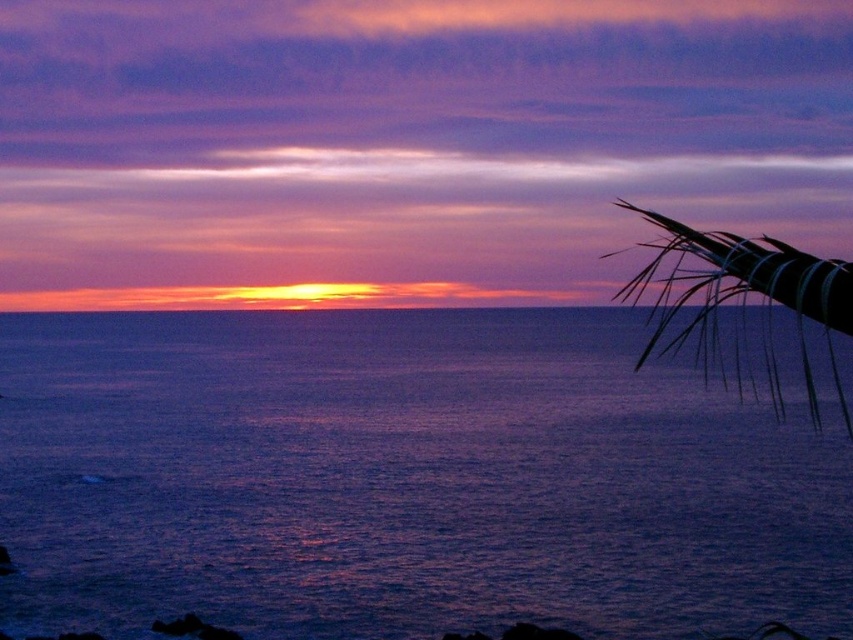
Question: Is purple water at center positioned at the back of silvery metallic palm fronds at upper right?

Choices:
 (A) yes
 (B) no

Answer: (A)

Question: Does purple water at center appear on the left side of silvery metallic palm fronds at upper right?

Choices:
 (A) yes
 (B) no

Answer: (A)

Question: Which object appears closest to the camera in this image?

Choices:
 (A) purple water at center
 (B) silvery metallic palm fronds at upper right

Answer: (B)

Question: Is purple water at center to the right of silvery metallic palm fronds at upper right from the viewer's perspective?

Choices:
 (A) no
 (B) yes

Answer: (A)